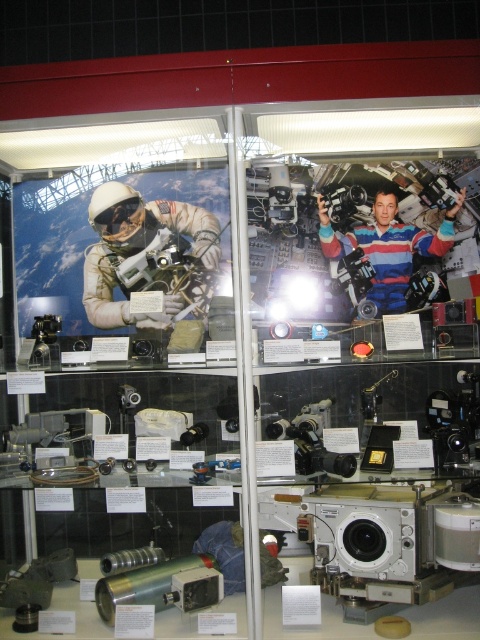
Question: Does matte white spacesuit at center have a lesser width compared to striped fabric astronaut at center?

Choices:
 (A) yes
 (B) no

Answer: (A)

Question: Among these objects, which one is nearest to the camera?

Choices:
 (A) striped fabric astronaut at center
 (B) matte white spacesuit at center

Answer: (A)

Question: From the image, what is the correct spatial relationship of matte white spacesuit at center in relation to striped fabric astronaut at center?

Choices:
 (A) left
 (B) right

Answer: (A)

Question: Can you confirm if matte white spacesuit at center is thinner than striped fabric astronaut at center?

Choices:
 (A) yes
 (B) no

Answer: (A)